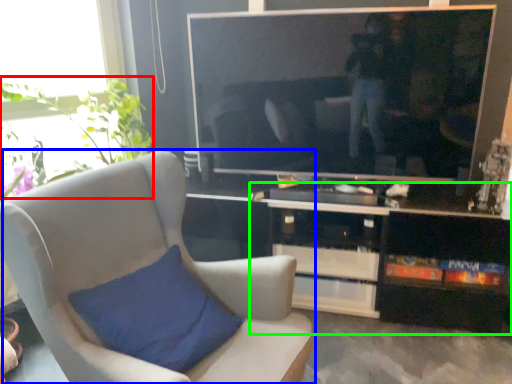
Question: Considering the real-world distances, which object is farthest from plant (highlighted by a red box)? chair (highlighted by a blue box) or cabinetry (highlighted by a green box)?

Choices:
 (A) chair
 (B) cabinetry

Answer: (B)